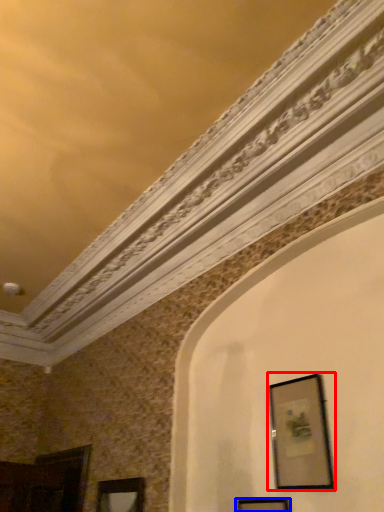
Question: Which object appears closest to the camera in this image, picture frame (highlighted by a red box) or picture frame (highlighted by a blue box)?

Choices:
 (A) picture frame
 (B) picture frame

Answer: (B)